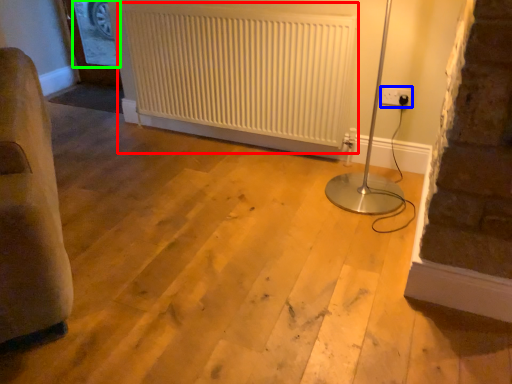
Question: Which is farther away from radiator (highlighted by a red box)? electric outlet (highlighted by a blue box) or window screen (highlighted by a green box)?

Choices:
 (A) electric outlet
 (B) window screen

Answer: (B)